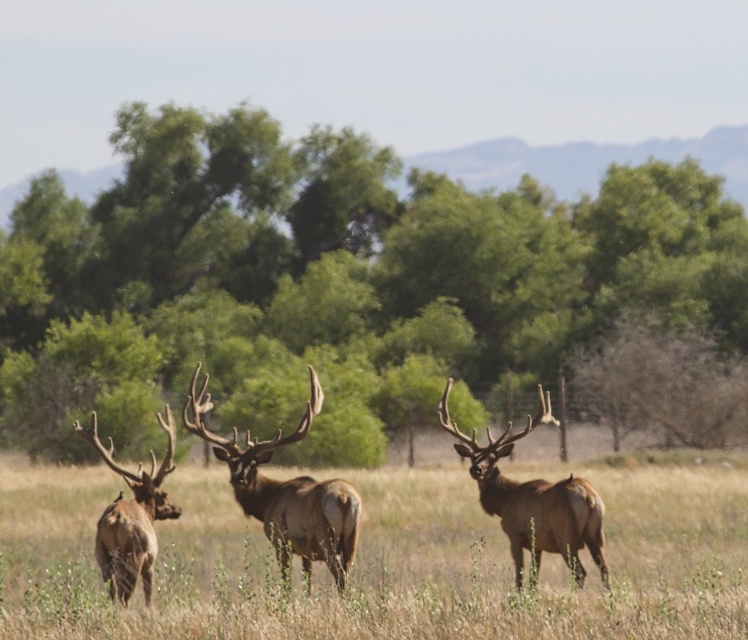
Question: Based on their relative distances, which object is farther from the brown velvet deer at center?

Choices:
 (A) green leafy tree at center
 (B) brown velvet elk at center
 (C) brown velvet antlered deer at center
 (D) brown grass at center

Answer: (A)

Question: Can you confirm if green leafy tree at center is positioned below brown velvet elk at center?

Choices:
 (A) yes
 (B) no

Answer: (B)

Question: Does green leafy tree at center have a smaller size compared to brown grass at center?

Choices:
 (A) yes
 (B) no

Answer: (B)

Question: Can you confirm if brown velvet elk at center is wider than brown velvet antlered deer at center?

Choices:
 (A) yes
 (B) no

Answer: (B)

Question: Among these objects, which one is nearest to the camera?

Choices:
 (A) brown velvet elk at center
 (B) brown velvet antlered deer at center
 (C) brown grass at center

Answer: (C)

Question: Which point is farther to the camera?

Choices:
 (A) green leafy tree at center
 (B) brown velvet deer at center
 (C) brown grass at center
 (D) brown velvet elk at center

Answer: (A)